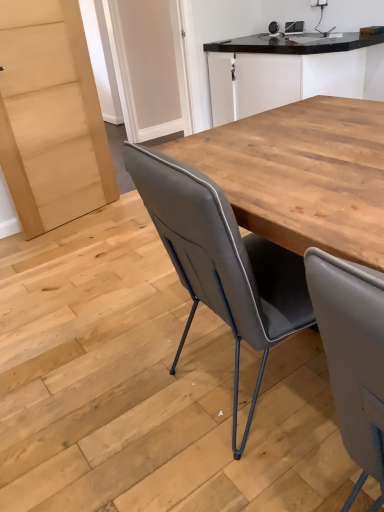
Question: Is matte gray leather chair at center oriented towards black granite countertop at upper center?

Choices:
 (A) no
 (B) yes

Answer: (A)

Question: From the image's perspective, is matte gray leather chair at center below black granite countertop at upper center?

Choices:
 (A) no
 (B) yes

Answer: (B)

Question: Is matte gray leather chair at center thinner than black granite countertop at upper center?

Choices:
 (A) no
 (B) yes

Answer: (A)

Question: Is matte gray leather chair at center at the left side of black granite countertop at upper center?

Choices:
 (A) no
 (B) yes

Answer: (B)

Question: From the image's perspective, is matte gray leather chair at center over black granite countertop at upper center?

Choices:
 (A) no
 (B) yes

Answer: (A)

Question: Is matte gray leather chair at center far away from black granite countertop at upper center?

Choices:
 (A) no
 (B) yes

Answer: (B)

Question: Considering the relative positions of black granite countertop at upper center and matte gray leather chair at center in the image provided, is black granite countertop at upper center behind matte gray leather chair at center?

Choices:
 (A) yes
 (B) no

Answer: (A)

Question: From a real-world perspective, is black granite countertop at upper center located higher than matte gray leather chair at center?

Choices:
 (A) no
 (B) yes

Answer: (B)

Question: Is black granite countertop at upper center to the left of matte gray leather chair at center from the viewer's perspective?

Choices:
 (A) no
 (B) yes

Answer: (A)

Question: Is black granite countertop at upper center facing away from matte gray leather chair at center?

Choices:
 (A) no
 (B) yes

Answer: (A)

Question: Does black granite countertop at upper center have a lesser height compared to matte gray leather chair at center?

Choices:
 (A) no
 (B) yes

Answer: (B)

Question: Can you confirm if black granite countertop at upper center is positioned to the right of matte gray leather chair at center?

Choices:
 (A) yes
 (B) no

Answer: (A)

Question: Is point (213, 91) positioned closer to the camera than point (170, 369)?

Choices:
 (A) closer
 (B) farther

Answer: (B)